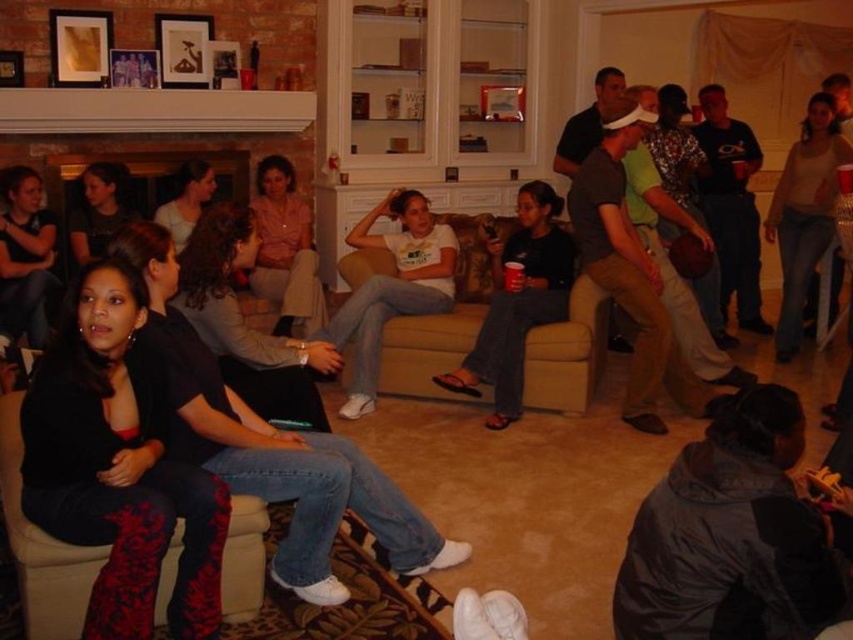
Question: Which point is farther to the camera?

Choices:
 (A) matte black jacket at left
 (B) dark gray fleece jacket at lower right
 (C) white cotton t-shirt at center

Answer: (A)

Question: Is matte beige shirt at center positioned before matte gray sweater at center?

Choices:
 (A) no
 (B) yes

Answer: (A)

Question: Is dark gray fabric pants at center to the left of matte beige shirt at center from the viewer's perspective?

Choices:
 (A) no
 (B) yes

Answer: (B)

Question: Which point is closer to the camera?

Choices:
 (A) (206, 196)
 (B) (747, 442)
 (C) (99, 237)
 (D) (401, 216)

Answer: (B)

Question: Among these objects, which one is nearest to the camera?

Choices:
 (A) dark gray fleece jacket at lower right
 (B) matte black jacket at left
 (C) beige fabric couch at center

Answer: (A)

Question: Is matte beige shirt at center in front of matte black jacket at left?

Choices:
 (A) yes
 (B) no

Answer: (B)